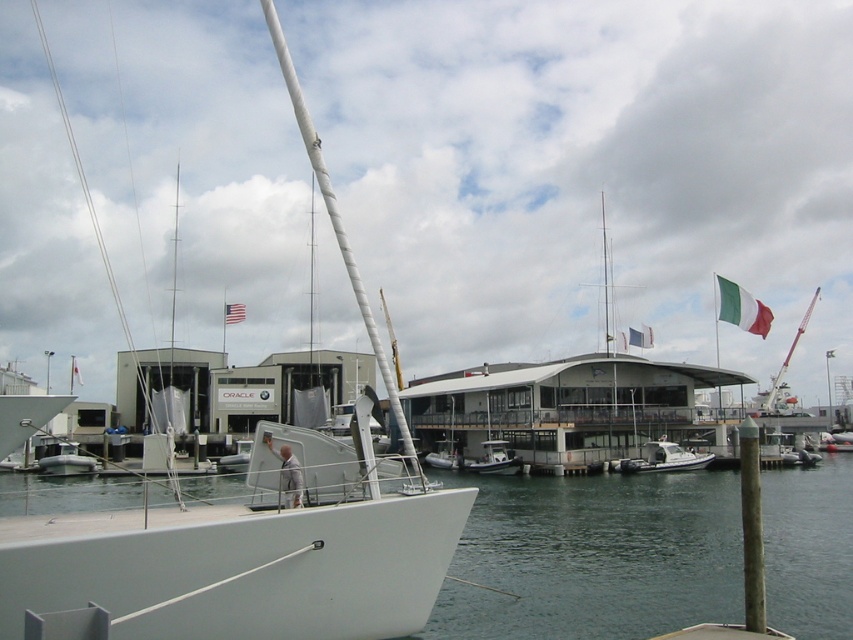
You are standing at the pier and want to walk from point A to point B. Point A is at coordinates point (747, 300) and point B is at coordinates point (86, 456). Which direction should you move to get from point A to point B?

To move from point A to point B, you should move downward and to the right since point B is located at a lower vertical position and to the right horizontally compared to point A.

You are standing on the pier and want to tie your boat to the brown wood post at lower right. Based on the coordinates provided, can you reach the post from your current position at point (751, 528)?

The point (751, 528) marks the brown wood post at lower right, so you are already at the post and can tie your boat there.